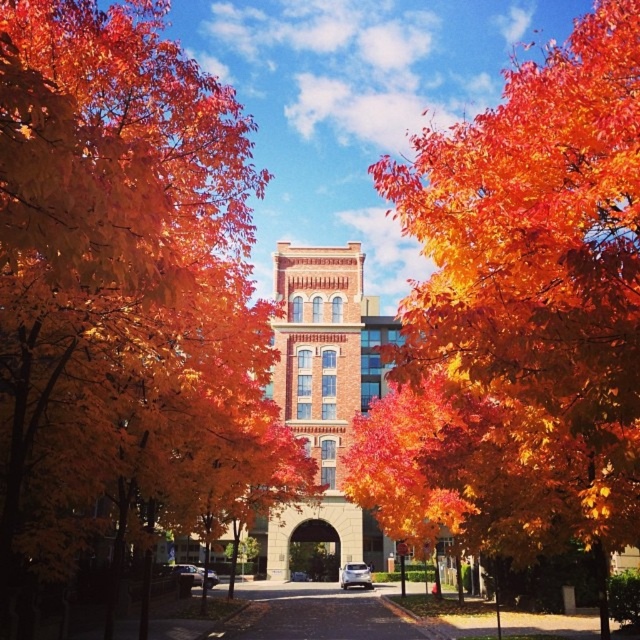
Question: Can you confirm if shiny orange leaves at center is smaller than orange leafy tree at center?

Choices:
 (A) no
 (B) yes

Answer: (B)

Question: Which object appears farthest from the camera in this image?

Choices:
 (A) orange leafy tree at center
 (B) shiny orange leaves at center

Answer: (A)

Question: Is shiny orange leaves at center thinner than orange leafy tree at center?

Choices:
 (A) no
 (B) yes

Answer: (B)

Question: Which point is farther to the camera?

Choices:
 (A) (630, 368)
 (B) (65, 212)

Answer: (A)

Question: Does shiny orange leaves at center lie in front of orange leafy tree at center?

Choices:
 (A) yes
 (B) no

Answer: (A)